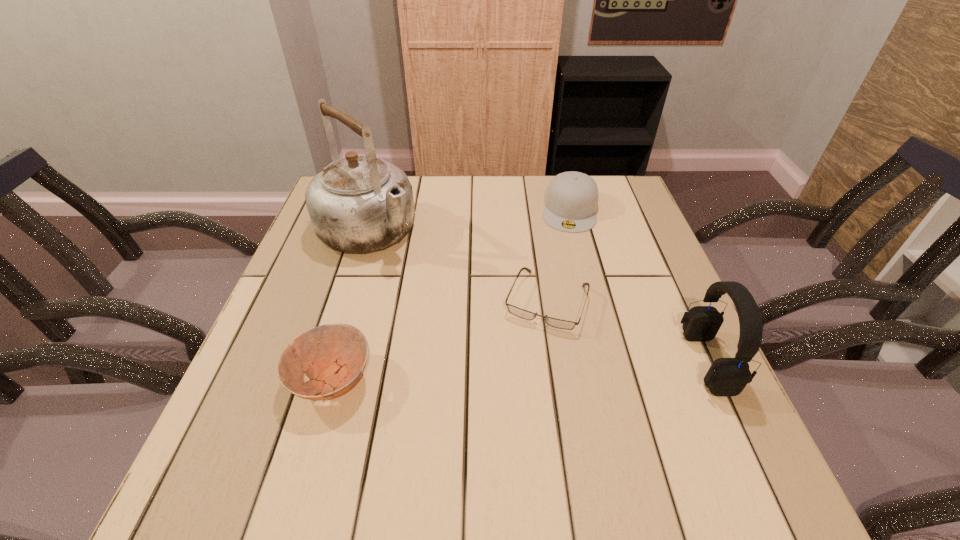
You are a GUI agent. You are given a task and a screenshot of the screen. Output one action in this format:
    pyautogui.click(x=<x>, y=<y>)
    Task: Click on the vacant point located between the tallest object and the bowl
    This screenshot has height=540, width=960.
    Given the screenshot: What is the action you would take?
    pyautogui.click(x=350, y=305)

The height and width of the screenshot is (540, 960). In order to click on empty location between the tallest object and the spectacles in this screenshot , I will do `click(457, 266)`.

At what (x,y) coordinates should I click in order to perform the action: click on vacant area that lies between the cap and the shortest object. Please return your answer as a coordinate pair (x, y). The width and height of the screenshot is (960, 540). Looking at the image, I should click on (558, 255).

Locate an element on the screen. Image resolution: width=960 pixels, height=540 pixels. the fourth closest object to the third tallest object is located at coordinates (338, 352).

This screenshot has width=960, height=540. I want to click on object that is the second closest to the fourth tallest object, so click(x=524, y=314).

Locate an element on the screen. blank area in the image that satisfies the following two spatial constraints: 1. on the front side of the third tallest object; 2. on the headband of the second tallest object is located at coordinates (610, 361).

The image size is (960, 540). What are the coordinates of `free space in the image that satisfies the following two spatial constraints: 1. on the front side of the cap; 2. on the headband of the rightmost object` in the screenshot? It's located at (610, 361).

I want to click on vacant space that satisfies the following two spatial constraints: 1. on the front side of the kettle; 2. on the headband of the rightmost object, so click(328, 361).

Where is `free space that satisfies the following two spatial constraints: 1. on the front side of the shortest object; 2. on the headband of the headset`? free space that satisfies the following two spatial constraints: 1. on the front side of the shortest object; 2. on the headband of the headset is located at coordinates (555, 361).